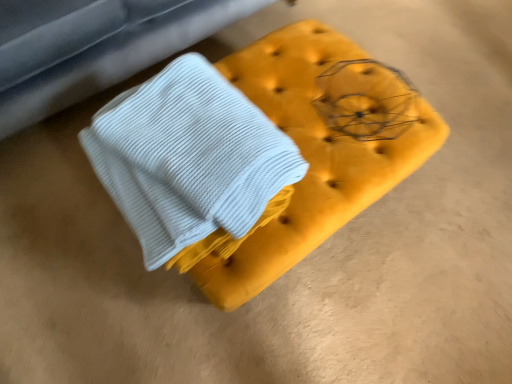
Locate an element on the screen. The image size is (512, 384). free space in front of velvet yellow ottoman at center, the 2th furniture from the top is located at coordinates (261, 330).